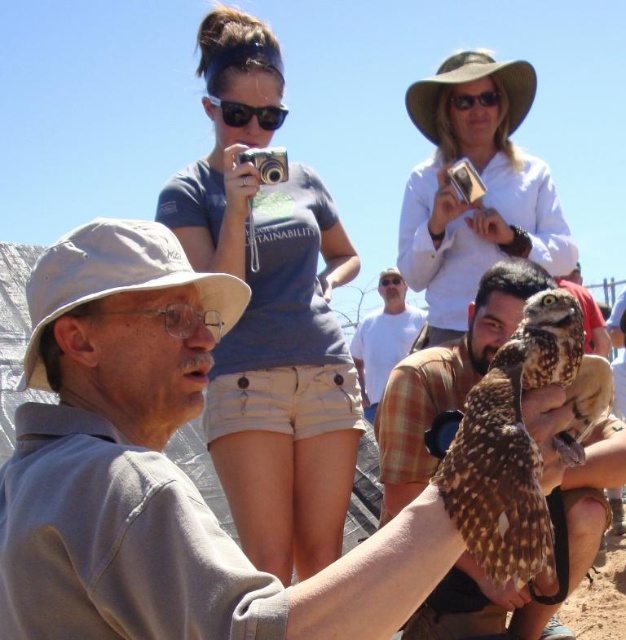
Looking at this image, you are a photographer trying to capture a clear photo of the brown speckled owl at center. However, the white cotton shirt at upper center is blocking your view. Can you estimate whether the shirt is large enough to completely cover the owl in the frame?

The white cotton shirt at upper center is larger in size than the brown speckled owl at center, so it could potentially block the entire owl from view if positioned directly in front of it.

Based on the scene description, which object is wider when comparing the white cotton shirt at upper center and the black plastic sunglasses at upper center?

The white cotton shirt at upper center is wider than the black plastic sunglasses at upper center according to the description.